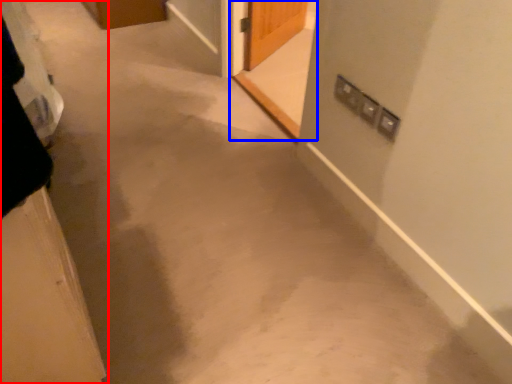
Question: Among these objects, which one is nearest to the camera, door (highlighted by a red box) or screen door (highlighted by a blue box)?

Choices:
 (A) door
 (B) screen door

Answer: (A)